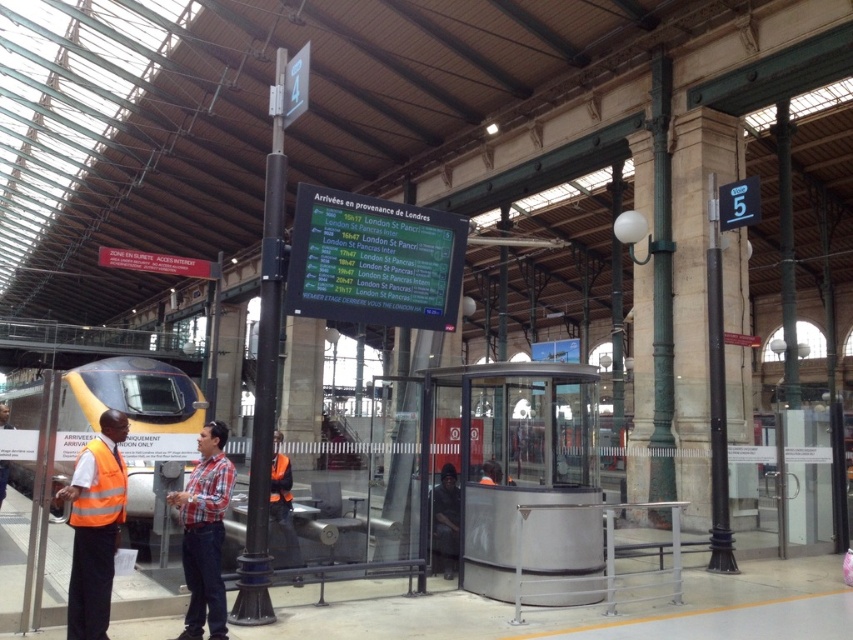
Consider the image. Can you confirm if high visibility vest at left is positioned above high visibility orange safety vest at lower left?

No, high visibility vest at left is not above high visibility orange safety vest at lower left.

Between point (115, 516) and point (102, 454), which one is positioned behind?

Positioned behind is point (115, 516).

Between point (90, 579) and point (94, 513), which one is positioned behind?

The point (94, 513) is more distant.

Locate an element on the screen. The height and width of the screenshot is (640, 853). high visibility vest at left is located at coordinates (96, 525).

Between plaid shirt at center and dark blue uniform at center, which one appears on the left side from the viewer's perspective?

plaid shirt at center

Locate an element on the screen. The width and height of the screenshot is (853, 640). plaid shirt at center is located at coordinates (206, 532).

Is point (196, 625) positioned behind point (438, 560)?

No, (196, 625) is closer to viewer.

Identify the location of plaid shirt at center. (206, 532).

Does high visibility orange safety vest at lower left come behind dark blue uniform at center?

No, high visibility orange safety vest at lower left is in front of dark blue uniform at center.

Consider the image. Who is positioned more to the left, high visibility orange safety vest at lower left or dark blue uniform at center?

From the viewer's perspective, high visibility orange safety vest at lower left appears more on the left side.

In the scene shown: Who is more forward, (103, 444) or (442, 570)?

Point (103, 444)

Where is `high visibility orange safety vest at lower left`? This screenshot has width=853, height=640. high visibility orange safety vest at lower left is located at coordinates (102, 490).